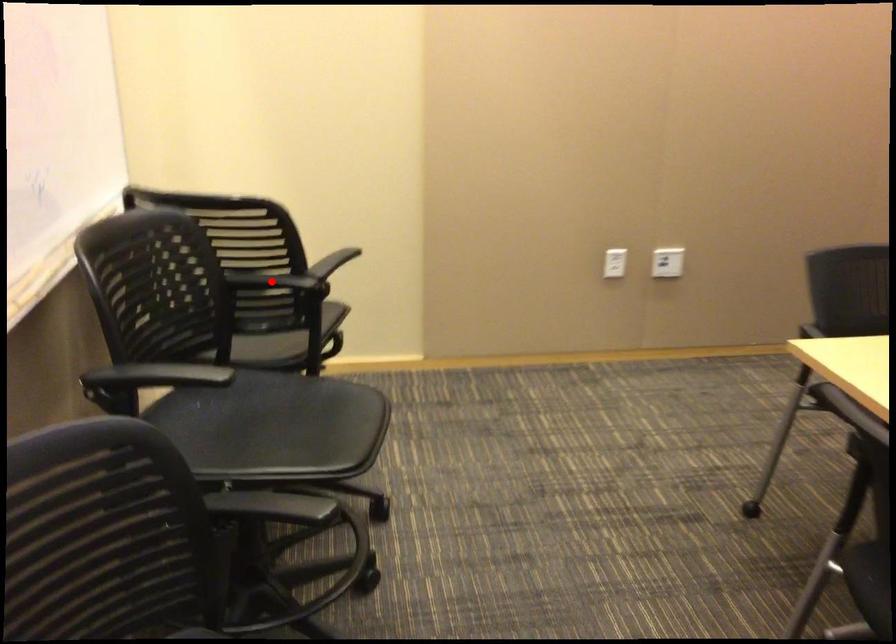
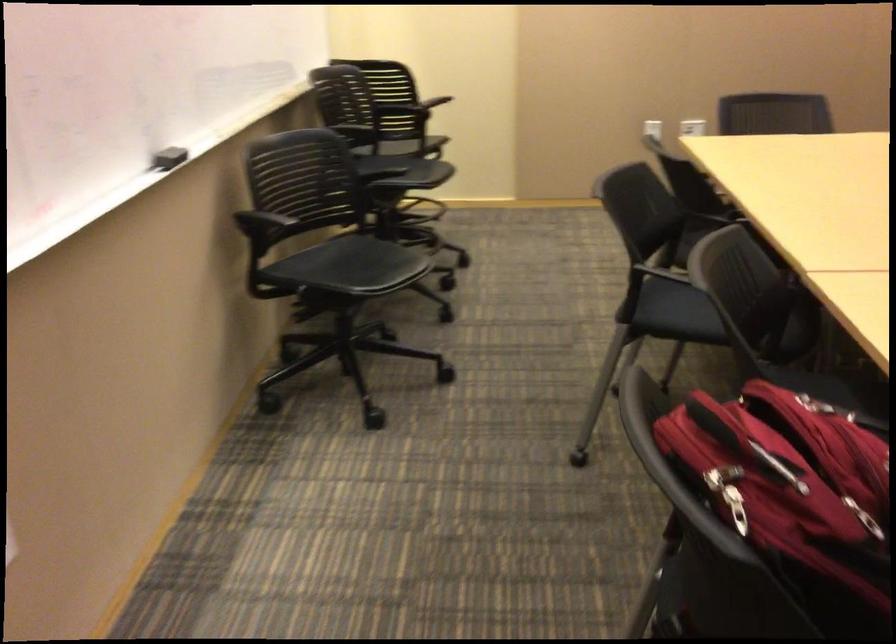
Question: I am providing you with two images of the same scene from different viewpoints. A red point is marked on the first image. Can you still see the location of the red point in image 2?

Choices:
 (A) Yes
 (B) No

Answer: (B)